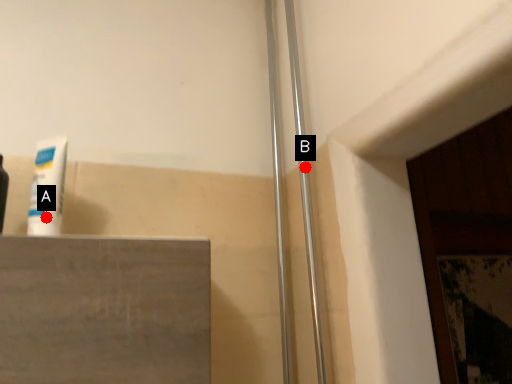
Question: Two points are circled on the image, labeled by A and B beside each circle. Among these points, which one is farthest from the camera?

Choices:
 (A) A is further
 (B) B is further

Answer: (B)